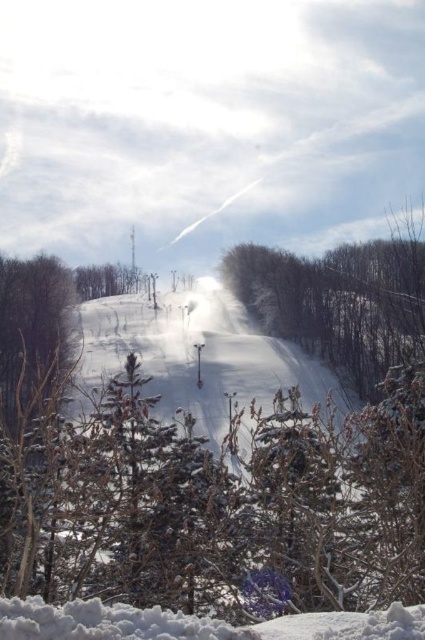
Who is positioned more to the right, brown textured tree at left or green matte tree at upper center?

Positioned to the right is brown textured tree at left.

Does point (28, 356) lie behind point (91, 268)?

That is False.

Locate an element on the screen. brown textured tree at left is located at coordinates (33, 326).